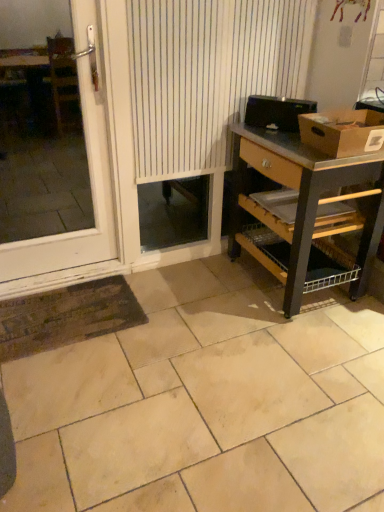
Question: Is beige ceramic tile at center surrounding white striped curtain at center?

Choices:
 (A) yes
 (B) no

Answer: (B)

Question: Is beige ceramic tile at center taller than white striped curtain at center?

Choices:
 (A) no
 (B) yes

Answer: (A)

Question: Is beige ceramic tile at center facing away from white striped curtain at center?

Choices:
 (A) no
 (B) yes

Answer: (A)

Question: Can you confirm if beige ceramic tile at center is positioned to the right of white striped curtain at center?

Choices:
 (A) no
 (B) yes

Answer: (B)

Question: Is beige ceramic tile at center next to white striped curtain at center and touching it?

Choices:
 (A) no
 (B) yes

Answer: (A)

Question: From a real-world perspective, is white plastic door at left positioned above or below beige ceramic tile at center?

Choices:
 (A) above
 (B) below

Answer: (A)

Question: From the image's perspective, is white plastic door at left located above or below beige ceramic tile at center?

Choices:
 (A) above
 (B) below

Answer: (A)

Question: Would you say white plastic door at left is inside or outside beige ceramic tile at center?

Choices:
 (A) outside
 (B) inside

Answer: (A)

Question: In terms of size, does white plastic door at left appear bigger or smaller than beige ceramic tile at center?

Choices:
 (A) small
 (B) big

Answer: (A)

Question: From a real-world perspective, is white plastic door at left above or below white striped curtain at center?

Choices:
 (A) below
 (B) above

Answer: (A)

Question: Considering the relative positions of white plastic door at left and white striped curtain at center in the image provided, is white plastic door at left to the left or to the right of white striped curtain at center?

Choices:
 (A) right
 (B) left

Answer: (B)

Question: Is point (79, 5) positioned closer to the camera than point (145, 101)?

Choices:
 (A) farther
 (B) closer

Answer: (A)

Question: Is white plastic door at left wider or thinner than white striped curtain at center?

Choices:
 (A) wide
 (B) thin

Answer: (B)

Question: Based on their positions, is brown cardboard box at upper right located to the left or right of white plastic door at left?

Choices:
 (A) right
 (B) left

Answer: (A)

Question: Considering the positions of brown cardboard box at upper right and white plastic door at left in the image, is brown cardboard box at upper right bigger or smaller than white plastic door at left?

Choices:
 (A) small
 (B) big

Answer: (A)